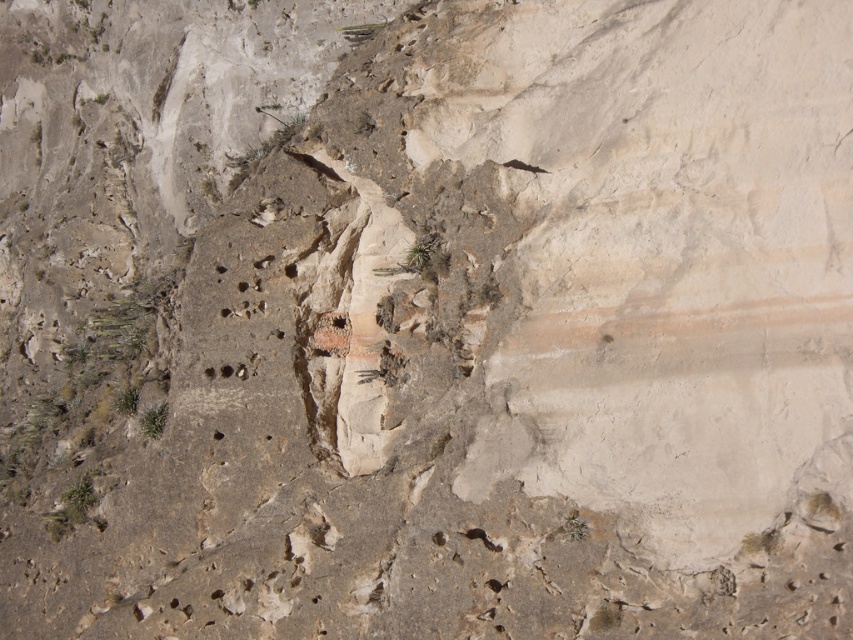
Is smooth sandstone hole at lower center below smooth stone hole at center?

No, smooth sandstone hole at lower center is not below smooth stone hole at center.

Is smooth sandstone hole at lower center above smooth stone hole at center?

Indeed, smooth sandstone hole at lower center is positioned over smooth stone hole at center.

Locate an element on the screen. This screenshot has width=853, height=640. smooth sandstone hole at lower center is located at coordinates (225, 371).

Identify the location of smooth sandstone hole at lower center. This screenshot has height=640, width=853. (225, 371).